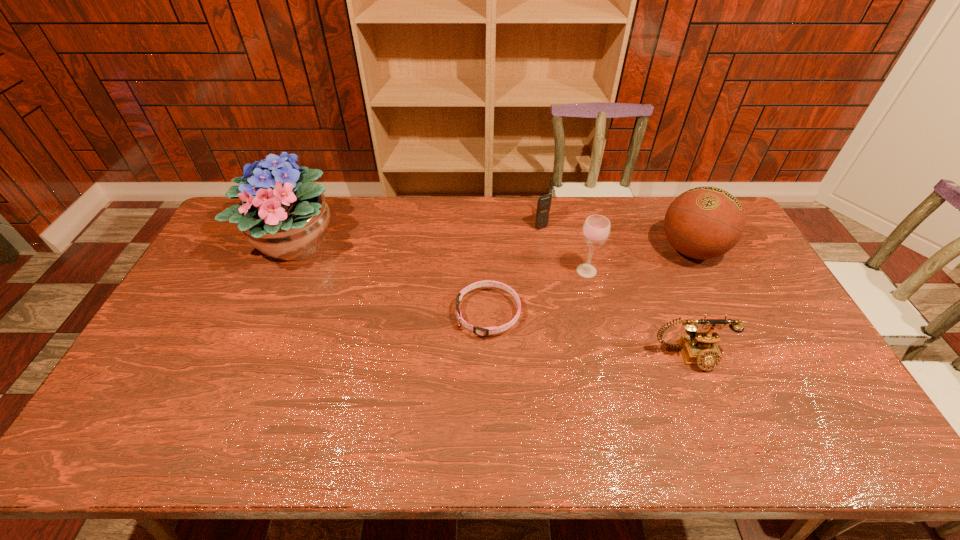
Find the location of a particular element. The width and height of the screenshot is (960, 540). free space located 0.060m on the back of the basketball is located at coordinates (675, 218).

Identify the location of vacant region located 0.380m on the front of the fourth shortest object. Image resolution: width=960 pixels, height=540 pixels. (613, 385).

Locate an element on the screen. This screenshot has width=960, height=540. vacant space located 0.350m on the keyboard of the fourth object from right to left is located at coordinates (438, 224).

At what (x,y) coordinates should I click in order to perform the action: click on vacant space located 0.330m on the keyboard of the fourth object from right to left. Please return your answer as a coordinate pair (x, y). This screenshot has width=960, height=540. Looking at the image, I should click on (444, 224).

At what (x,y) coordinates should I click in order to perform the action: click on free space located 0.190m on the keyboard of the fourth object from right to left. Please return your answer as a coordinate pair (x, y). Looking at the image, I should click on (482, 224).

Where is `vacant space located on the dial number of the telephone`? vacant space located on the dial number of the telephone is located at coordinates [728, 451].

Find the location of a particular element. The image size is (960, 540). vacant space situated 0.130m with the buckle on the fifth object from right to left is located at coordinates (413, 314).

The width and height of the screenshot is (960, 540). Find the location of `vacant space located 0.050m with the buckle on the fifth object from right to left`. vacant space located 0.050m with the buckle on the fifth object from right to left is located at coordinates [x=440, y=314].

Where is `vacant space located 0.200m with the buckle on the fifth object from right to left`? This screenshot has height=540, width=960. vacant space located 0.200m with the buckle on the fifth object from right to left is located at coordinates (390, 314).

Locate an element on the screen. bouquet at the far edge is located at coordinates (282, 214).